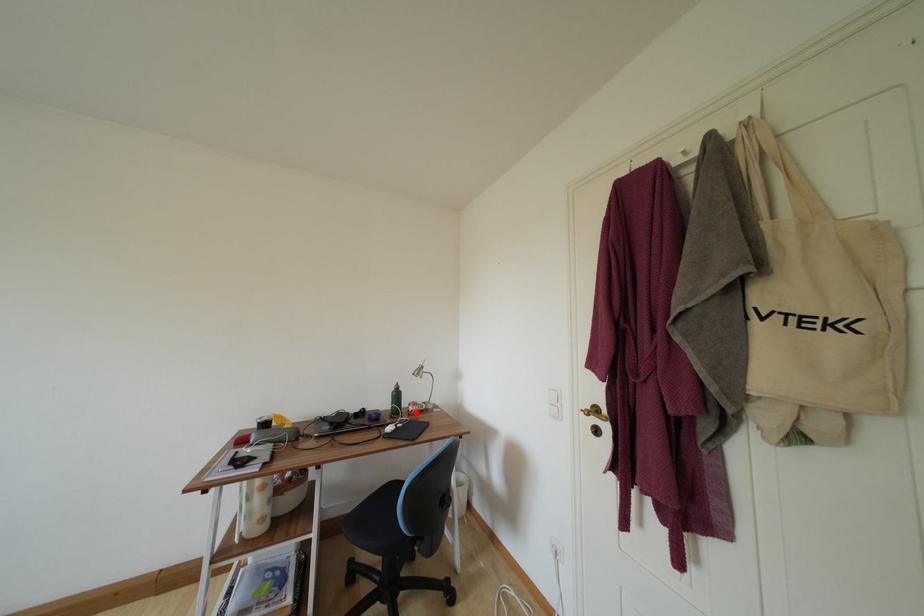
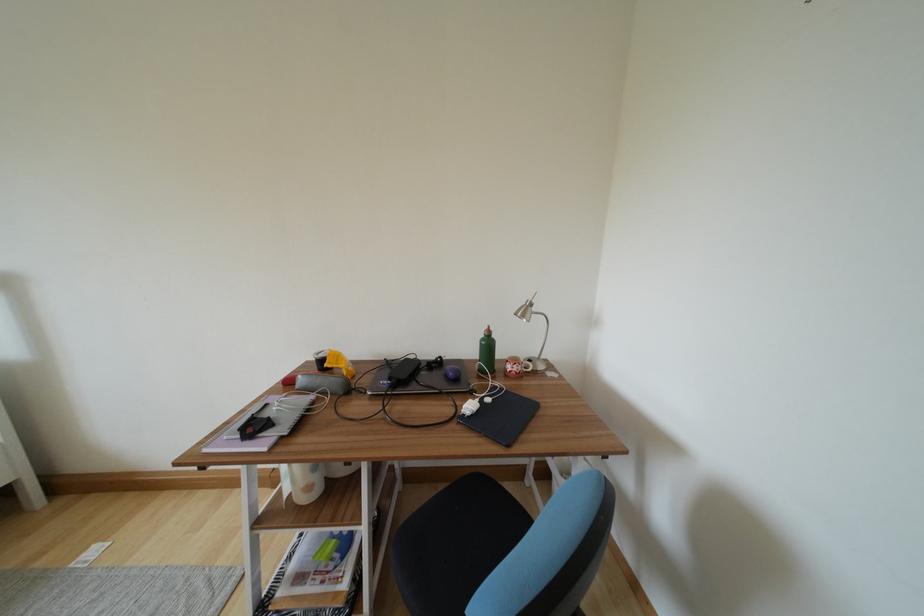
Where in the second image is the point corresponding to the highlighted location from the first image?

(514, 371)